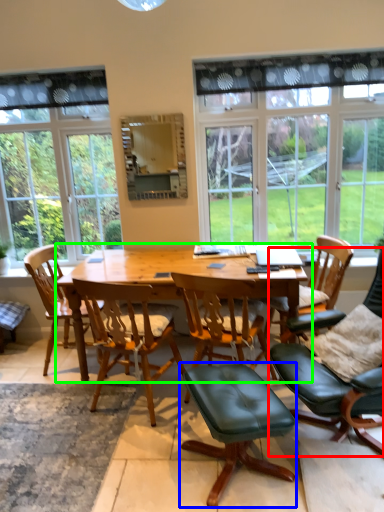
Question: Estimate the real-world distances between objects in this image. Which object is closer to chair (highlighted by a red box), stool (highlighted by a blue box) or kitchen & dining room table (highlighted by a green box)?

Choices:
 (A) stool
 (B) kitchen & dining room table

Answer: (A)